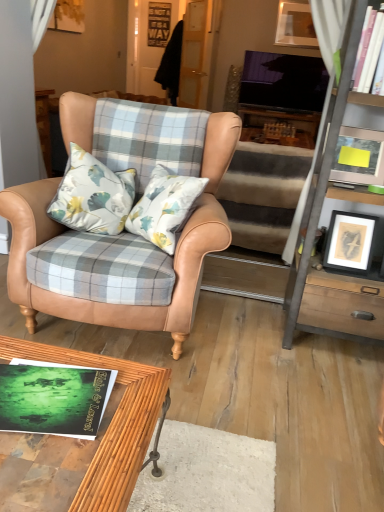
Find the location of a particular element. The height and width of the screenshot is (512, 384). free space in front of metallic gray cabinet at right is located at coordinates (334, 389).